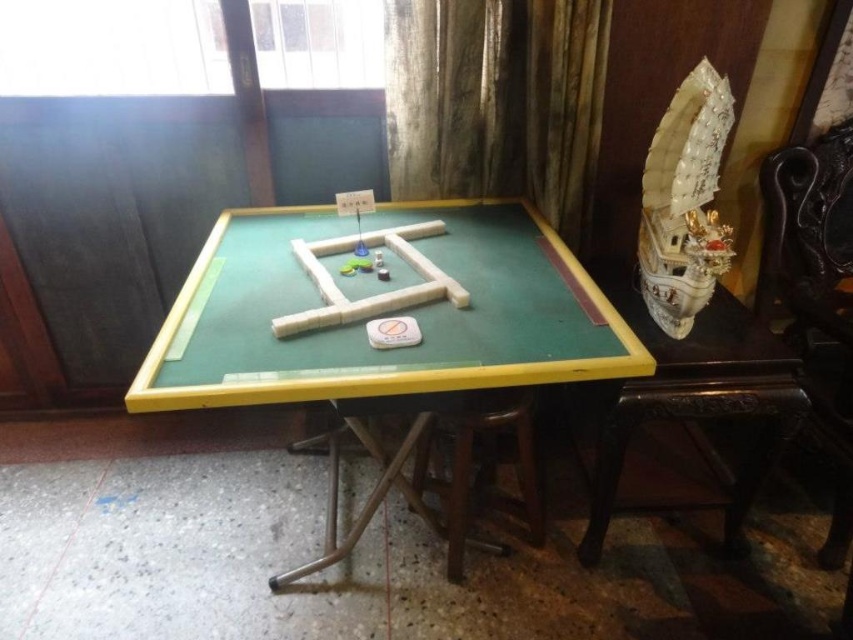
You are a player sitting at the mahjong table. You need to place your white matte wooden blocks at center onto the green felt table at center. Which direction should you move them to place them correctly?

The green felt table at center is to the right of the white matte wooden blocks at center, so you should move the white matte wooden blocks at center to the right to place them onto the green felt table at center.

You are playing mahjong and need to place a new tile near the ivory textured ship at upper right. According to the table layout, where should you place it?

The ivory textured ship at upper right is located at point (x=683, y=202), so you should place the new tile near that coordinate.

You are playing mahjong and need to place a new tile near the ivory textured ship at upper right. What are the coordinates where you should place it?

The ivory textured ship at upper right is located at coordinates point (x=683, y=202). Place the new tile near those coordinates.